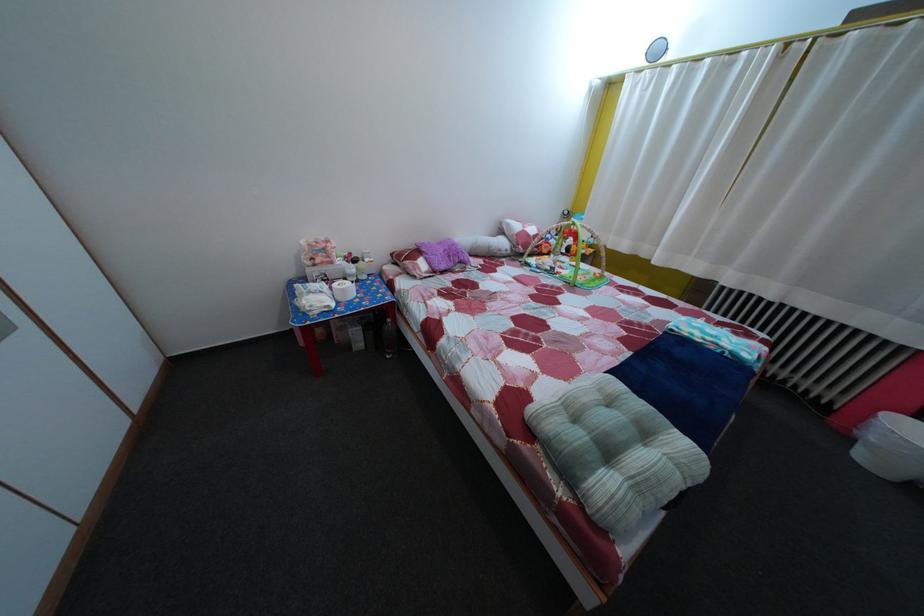
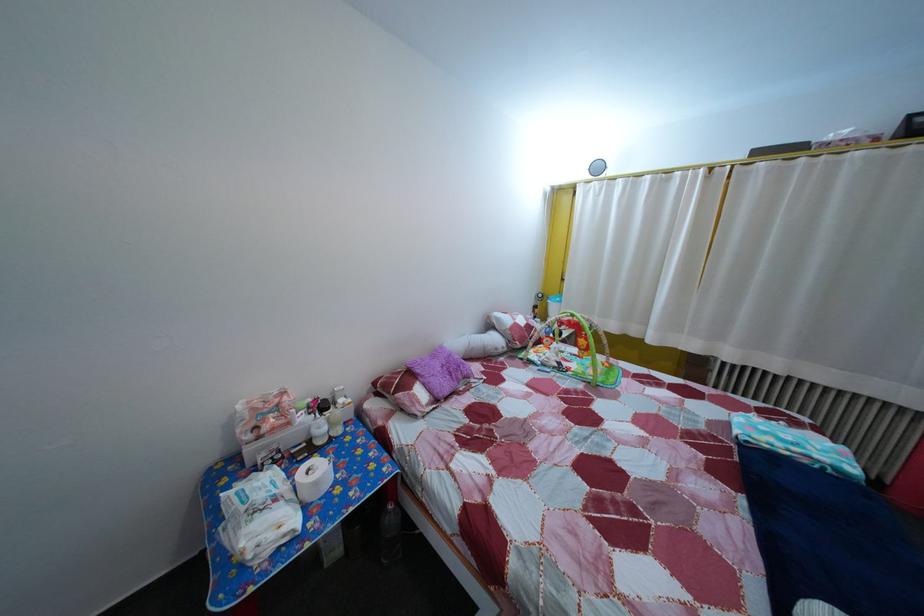
Where in the second image is the point corresponding to the point at 331,300 from the first image?

(285, 508)